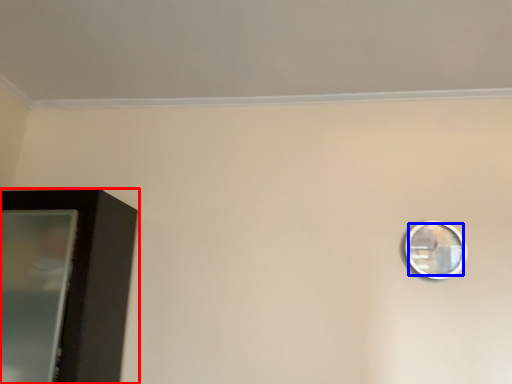
Question: Which point is closer to the camera, furniture (highlighted by a red box) or mirror (highlighted by a blue box)?

Choices:
 (A) furniture
 (B) mirror

Answer: (A)